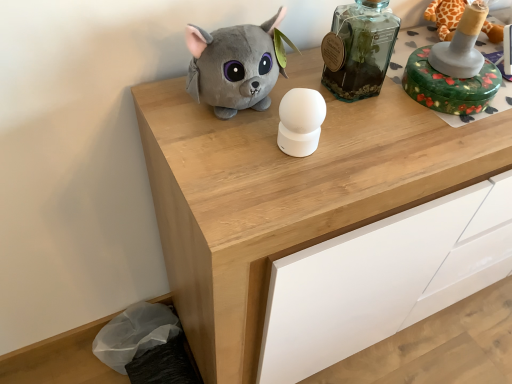
Locate an element on the screen. This screenshot has width=512, height=384. free space to the left of green floral-patterned box at upper right, which is counted as the second toy, starting from the left is located at coordinates (372, 104).